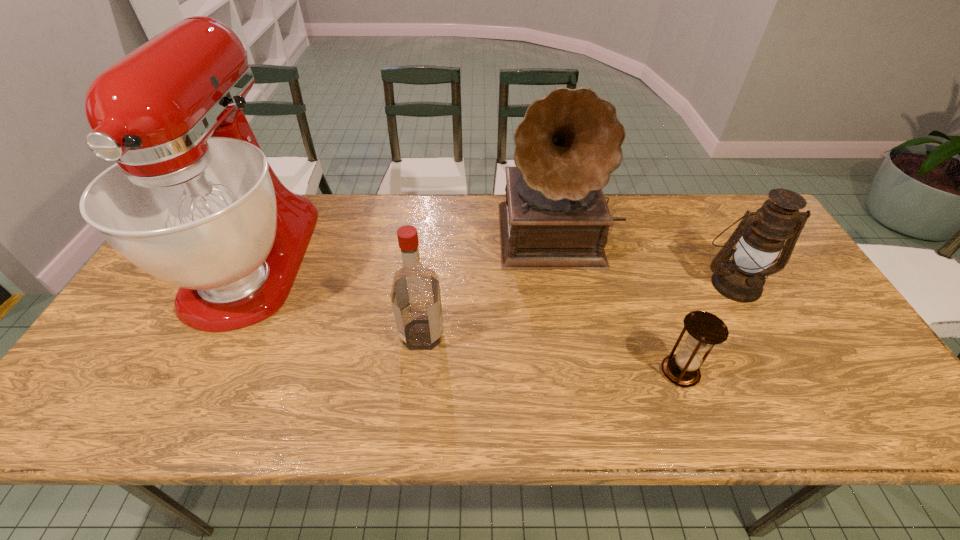
I want to click on object that is the third closest one to the rightmost object, so click(x=415, y=295).

This screenshot has width=960, height=540. Identify the location of free space that satisfies the following two spatial constraints: 1. from the horn of the record player; 2. on the front-facing side of the fourth object from right to left. (581, 334).

The width and height of the screenshot is (960, 540). In order to click on vacant position in the image that satisfies the following two spatial constraints: 1. from the horn of the second tallest object; 2. on the right side of the hourglass in this screenshot , I will do `click(588, 372)`.

At what (x,y) coordinates should I click in order to perform the action: click on vacant space that satisfies the following two spatial constraints: 1. at the attachment hub of the oil lamp; 2. on the left side of the leftmost object. Please return your answer as a coordinate pair (x, y). Looking at the image, I should click on (241, 283).

Locate an element on the screen. This screenshot has height=540, width=960. free location that satisfies the following two spatial constraints: 1. on the back side of the rightmost object; 2. on the left side of the nearest object is located at coordinates (648, 283).

Where is `free space that satisfies the following two spatial constraints: 1. from the horn of the second tallest object; 2. on the front-facing side of the second object from left to right`? free space that satisfies the following two spatial constraints: 1. from the horn of the second tallest object; 2. on the front-facing side of the second object from left to right is located at coordinates (581, 334).

You are a GUI agent. You are given a task and a screenshot of the screen. Output one action in this format:
    pyautogui.click(x=<x>, y=<y>)
    Task: Click on the free spot that satisfies the following two spatial constraints: 1. from the horn of the record player; 2. on the front-facing side of the liquor
    
    Given the screenshot: What is the action you would take?
    pyautogui.click(x=581, y=334)

Where is `free spot that satisfies the following two spatial constraints: 1. from the horn of the record player; 2. on the front-facing side of the liquor`? This screenshot has height=540, width=960. free spot that satisfies the following two spatial constraints: 1. from the horn of the record player; 2. on the front-facing side of the liquor is located at coordinates (581, 334).